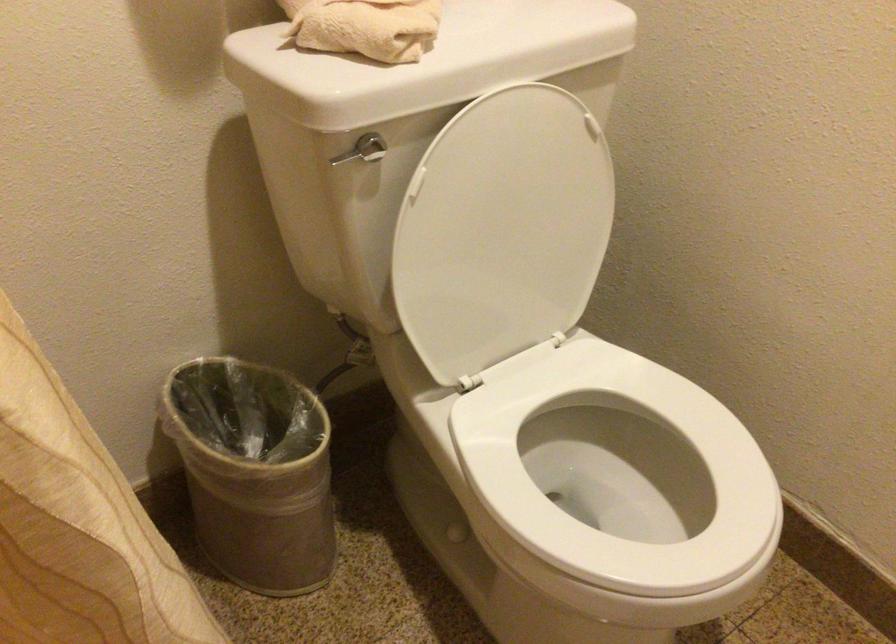
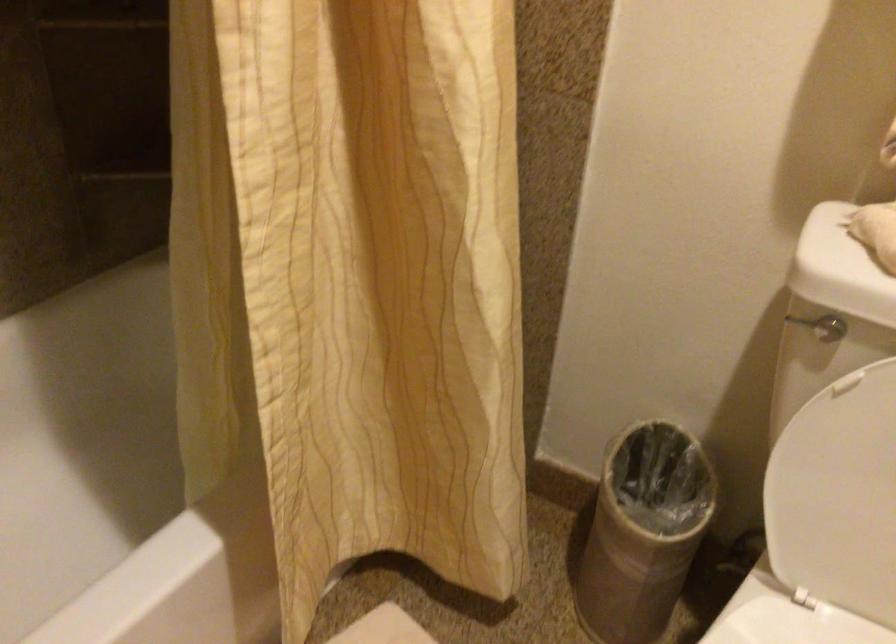
Question: The camera is either moving clockwise (left) or counter-clockwise (right) around the object. The first image is from the beginning of the video and the second image is from the end. Is the camera moving left or right when shooting the video?

Choices:
 (A) Left
 (B) Right

Answer: (B)